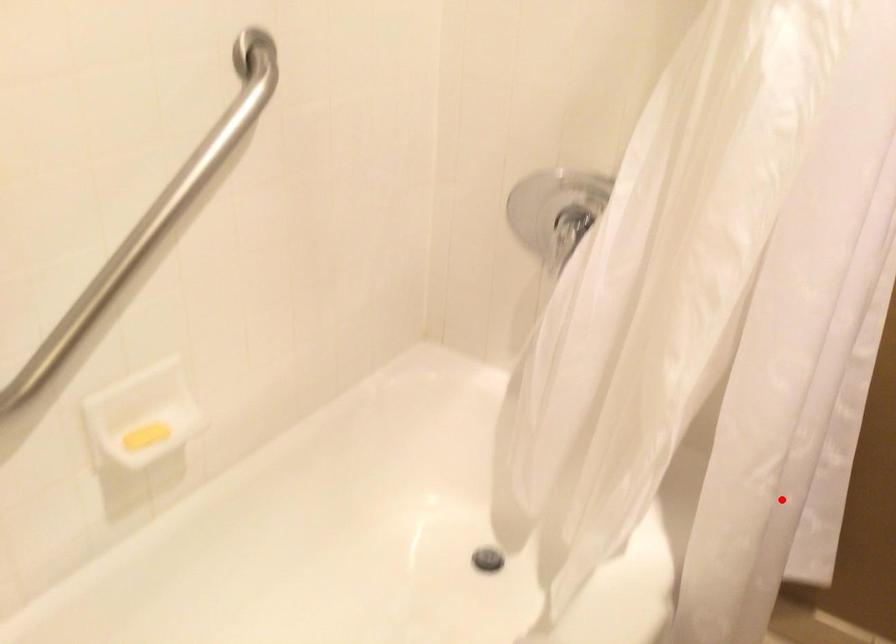
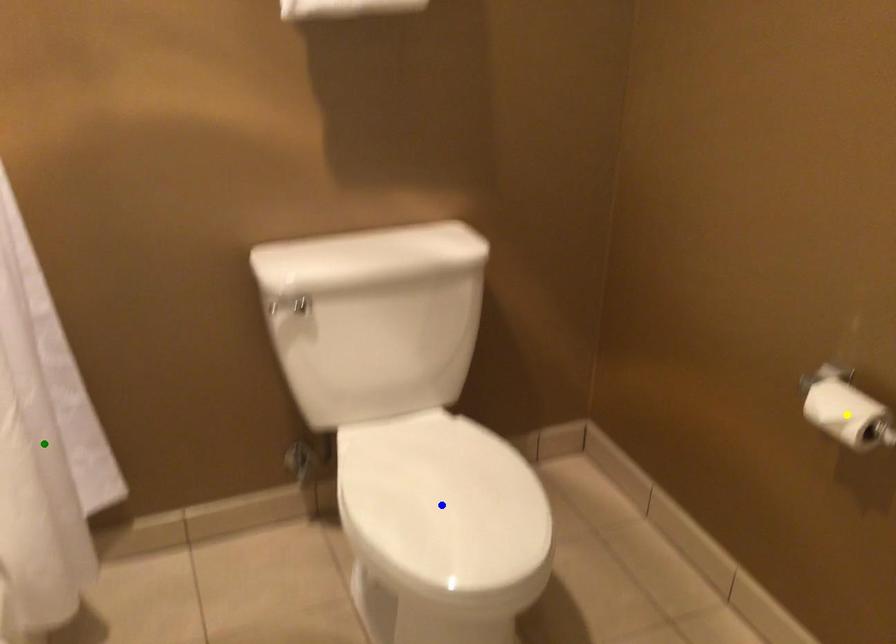
Question: I am providing you with two images of the same scene from different viewpoints. A red point is marked on the first image. You are given multiple points on the second image. Which point in image 2 is actually the same real-world point as the red point in image 1?

Choices:
 (A) yellow point
 (B) blue point
 (C) green point

Answer: (C)